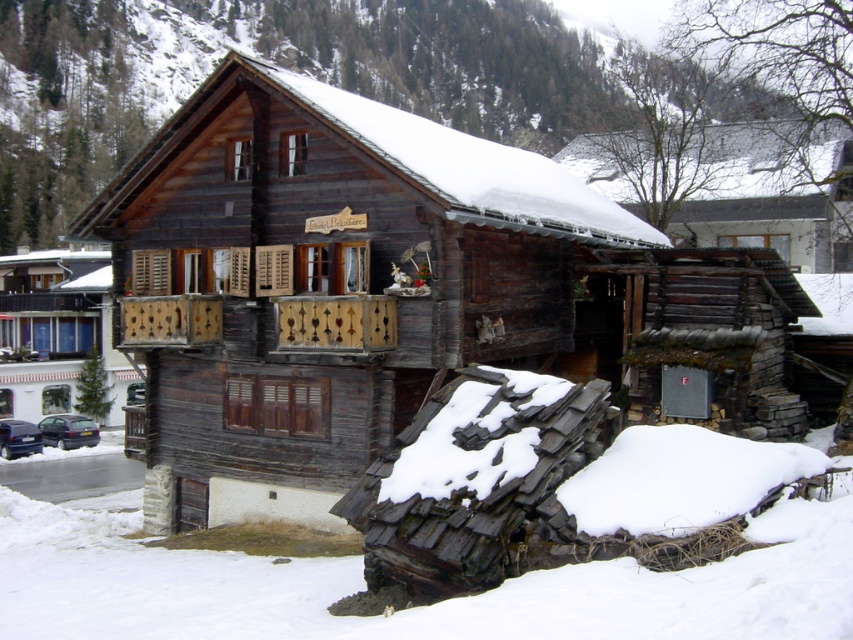
You are a delivery driver approaching the chalet and need to park your vehicle. You see the shiny black car at lower left and the dark blue metallic car at lower left. Can you determine which car is blocking the other one from leaving?

The shiny black car at lower left is positioned over dark blue metallic car at lower left, meaning it is blocking the dark blue metallic car at lower left from leaving.

You are standing at the entrance of the wooden cabin at center. If you walk straight ahead, which direction will you face?

Since the wooden cabin at center is located at point coordinates of (56,332), walking straight ahead from the entrance would mean facing north, assuming the coordinate system places the origin at the bottom left corner of the image. However, without specific orientation details, the exact direction cannot be determined with certainty.